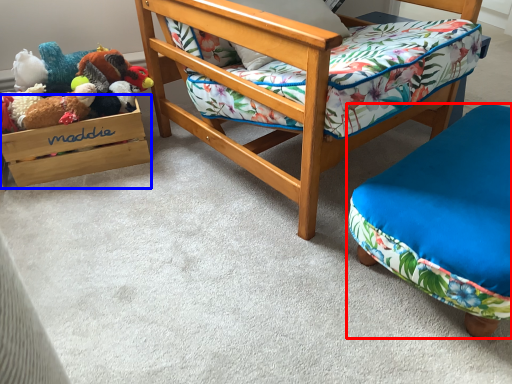
Question: Among these objects, which one is nearest to the camera, furniture (highlighted by a red box) or storage box (highlighted by a blue box)?

Choices:
 (A) furniture
 (B) storage box

Answer: (A)